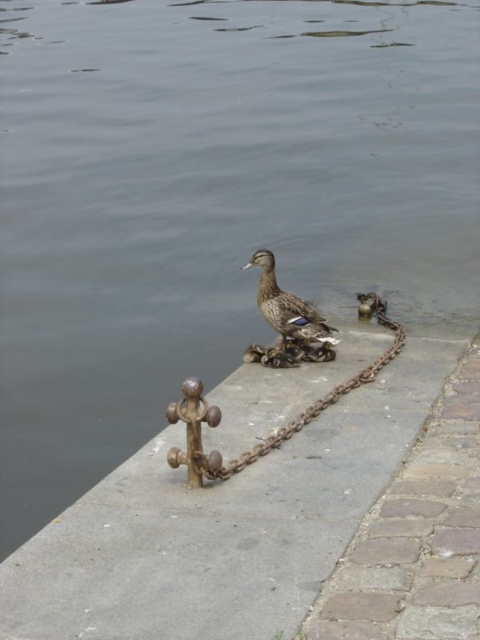
Who is higher up, shiny brown duckling at center or rusty metal chain at center?

shiny brown duckling at center is higher up.

Between point (292, 321) and point (238, 470), which one is positioned in front?

Point (238, 470) is in front.

Find the location of a particular element. This screenshot has height=640, width=480. shiny brown duckling at center is located at coordinates (288, 321).

Between point (248, 552) and point (255, 264), which one is positioned behind?

The point (255, 264) is more distant.

Does smooth concrete pavement at center have a lesser width compared to shiny brown duckling at center?

Incorrect, smooth concrete pavement at center's width is not less than shiny brown duckling at center's.

Does point (396, 380) lie behind point (274, 298)?

That is False.

I want to click on smooth concrete pavement at center, so click(225, 524).

Is smooth concrete pavement at center further to the viewer compared to rusty metal chain at center?

No.

Who is more distant from viewer, (238,433) or (373,301)?

Point (373,301)

Identify the location of smooth concrete pavement at center. (225, 524).